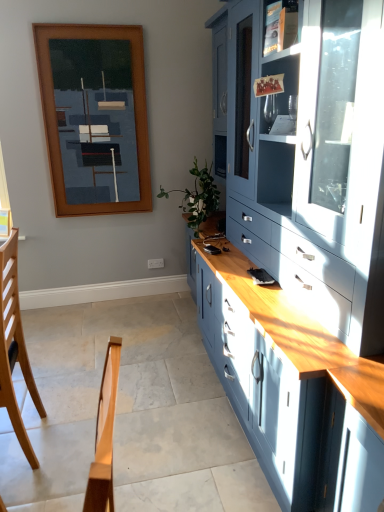
At what (x,y) coordinates should I click in order to perform the action: click on unoccupied region to the right of light brown wood chair at lower left. Please return your answer as a coordinate pair (x, y). Image resolution: width=384 pixels, height=512 pixels. Looking at the image, I should click on (65, 450).